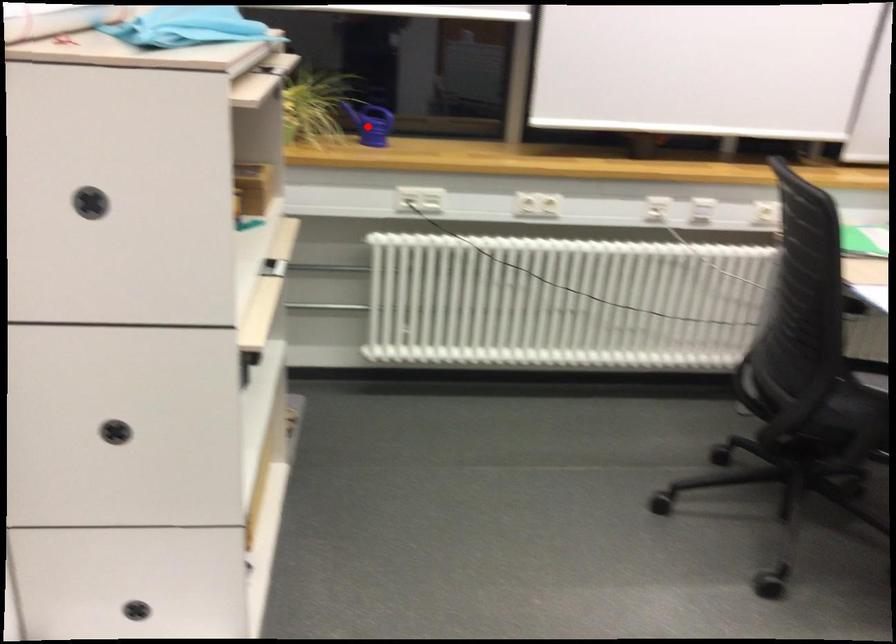
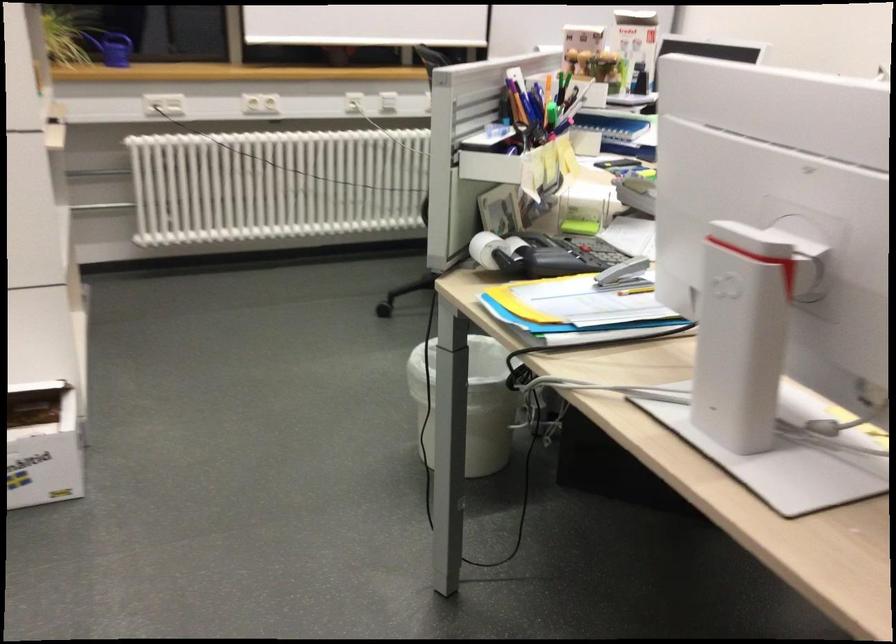
Find the pixel in the second image that matches the highlighted location in the first image.

(112, 48)